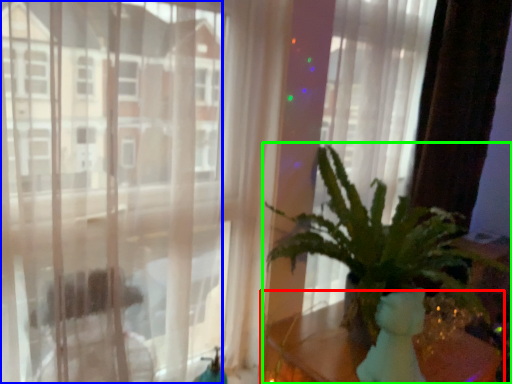
Question: Considering the real-world distances, which object is closest to table (highlighted by a red box)? window (highlighted by a blue box) or houseplant (highlighted by a green box).

Choices:
 (A) window
 (B) houseplant

Answer: (B)